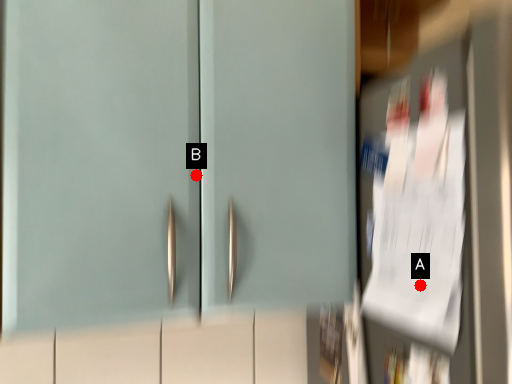
Question: Two points are circled on the image, labeled by A and B beside each circle. Which point is farther from the camera taking this photo?

Choices:
 (A) A is further
 (B) B is further

Answer: (B)